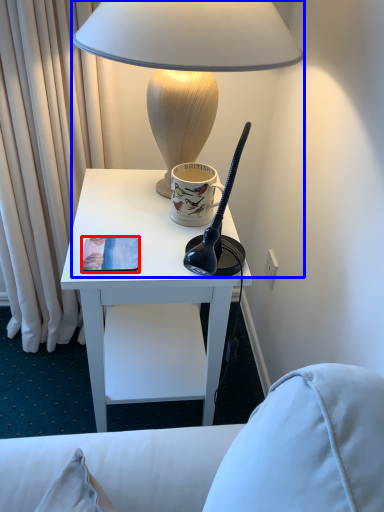
Question: Which point is closer to the camera, pad (highlighted by a red box) or lamp (highlighted by a blue box)?

Choices:
 (A) pad
 (B) lamp

Answer: (B)